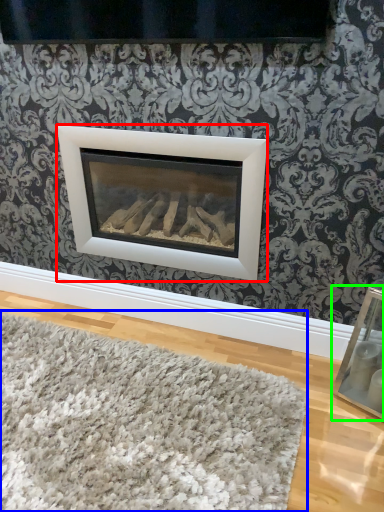
Question: Estimate the real-world distances between objects in this image. Which object is farther from fireplace (highlighted by a red box), mat (highlighted by a blue box) or picture frame (highlighted by a green box)?

Choices:
 (A) mat
 (B) picture frame

Answer: (B)